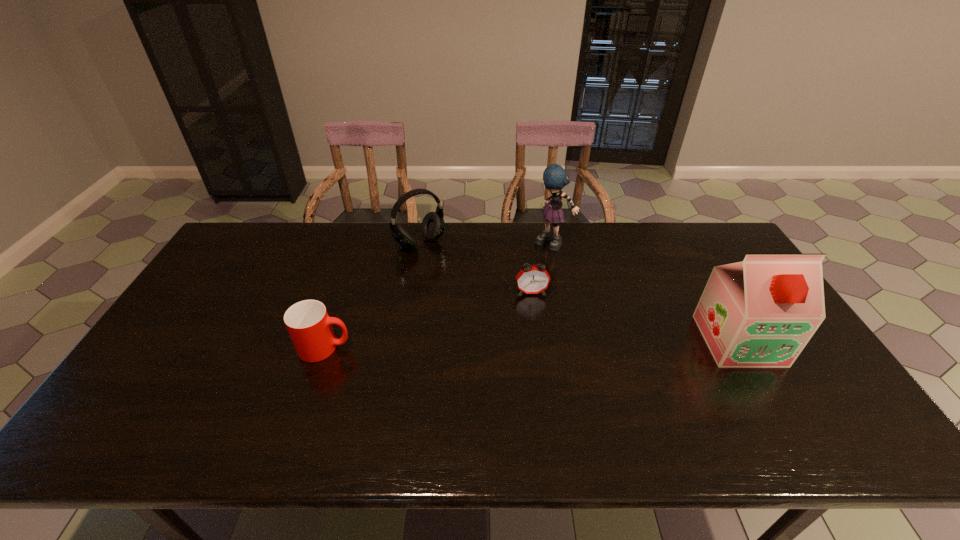
At what (x,y) coordinates should I click in order to perform the action: click on vacant space located 0.290m on the ear cups of the third shortest object. Please return your answer as a coordinate pair (x, y). The height and width of the screenshot is (540, 960). Looking at the image, I should click on (482, 303).

Locate an element on the screen. The image size is (960, 540). vacant position located on the front-facing side of the rag doll is located at coordinates (527, 285).

The width and height of the screenshot is (960, 540). Find the location of `free space located on the front-facing side of the rag doll`. free space located on the front-facing side of the rag doll is located at coordinates (539, 266).

This screenshot has width=960, height=540. Identify the location of vacant space located 0.360m on the front-facing side of the rag doll. pos(504,322).

The width and height of the screenshot is (960, 540). What are the coordinates of `vacant area situated 0.340m on the clock face of the third farthest object` in the screenshot? It's located at (547, 392).

Locate an element on the screen. The image size is (960, 540). vacant area situated on the clock face of the third farthest object is located at coordinates (541, 357).

Where is `vacant space situated 0.140m on the clock face of the third farthest object`? This screenshot has width=960, height=540. vacant space situated 0.140m on the clock face of the third farthest object is located at coordinates (538, 332).

Where is `headset at the far edge`? The image size is (960, 540). headset at the far edge is located at coordinates (432, 227).

The width and height of the screenshot is (960, 540). Find the location of `rag doll positioned at the far edge`. rag doll positioned at the far edge is located at coordinates (x=555, y=178).

Locate an element on the screen. The width and height of the screenshot is (960, 540). object that is at the right edge is located at coordinates (759, 313).